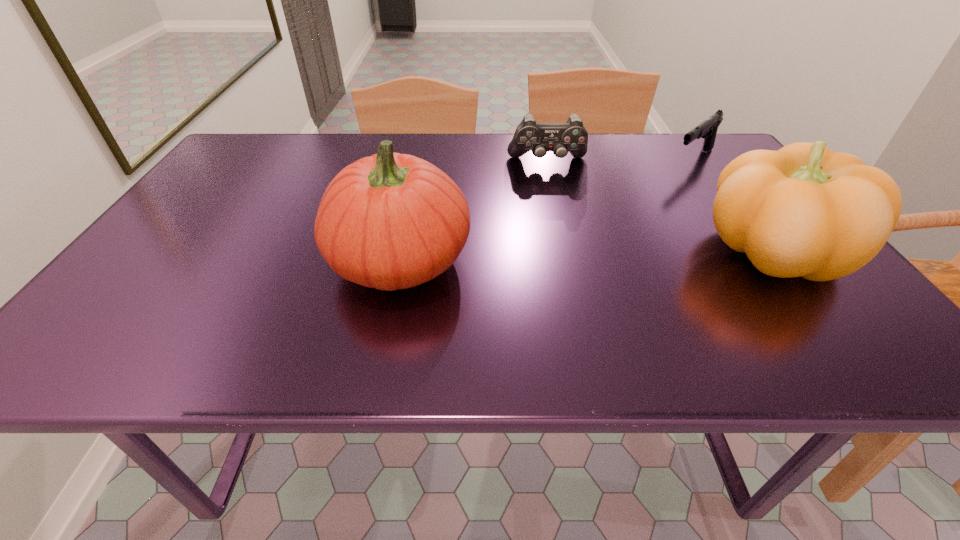
Locate an element on the screen. the left pumpkin is located at coordinates (389, 221).

Locate an element on the screen. The height and width of the screenshot is (540, 960). the right pumpkin is located at coordinates (805, 211).

The image size is (960, 540). Identify the location of the shortest object. (707, 129).

Where is `control`? control is located at coordinates (561, 138).

This screenshot has width=960, height=540. In order to click on free spot located on the left of the left pumpkin in this screenshot , I will do `click(204, 259)`.

I want to click on free spot located 0.130m on the left of the right pumpkin, so click(640, 252).

Where is `free point located 0.060m at the aiming end of the shortest object`? This screenshot has width=960, height=540. free point located 0.060m at the aiming end of the shortest object is located at coordinates (670, 179).

Where is `free location located 0.080m at the aiming end of the shortest object`? This screenshot has width=960, height=540. free location located 0.080m at the aiming end of the shortest object is located at coordinates (667, 181).

This screenshot has width=960, height=540. Identify the location of free space located 0.400m at the aiming end of the shortest object. (601, 234).

The height and width of the screenshot is (540, 960). In order to click on vacant area situated on the surface of the control with buttons in this screenshot , I will do `click(564, 247)`.